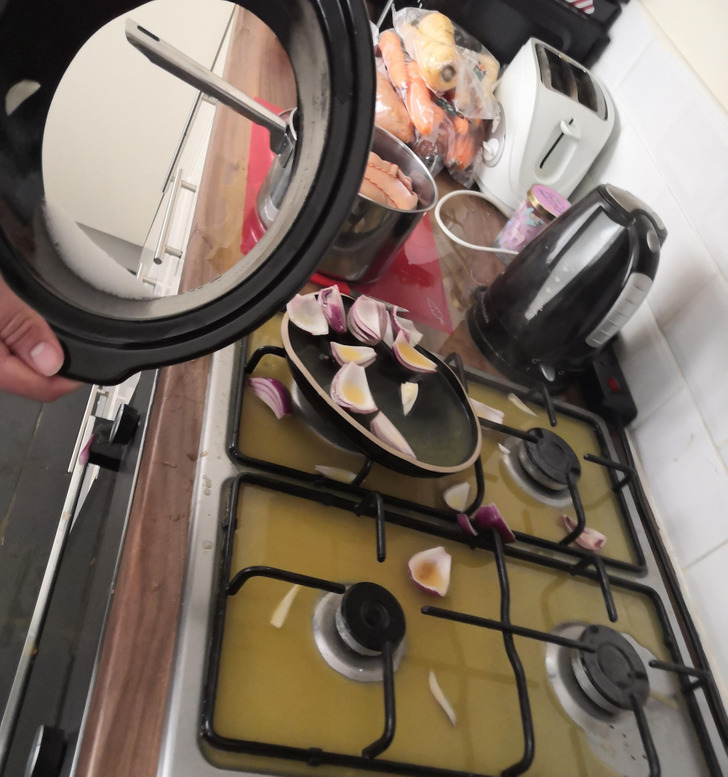
This screenshot has height=777, width=728. I want to click on white tile, so click(683, 476).